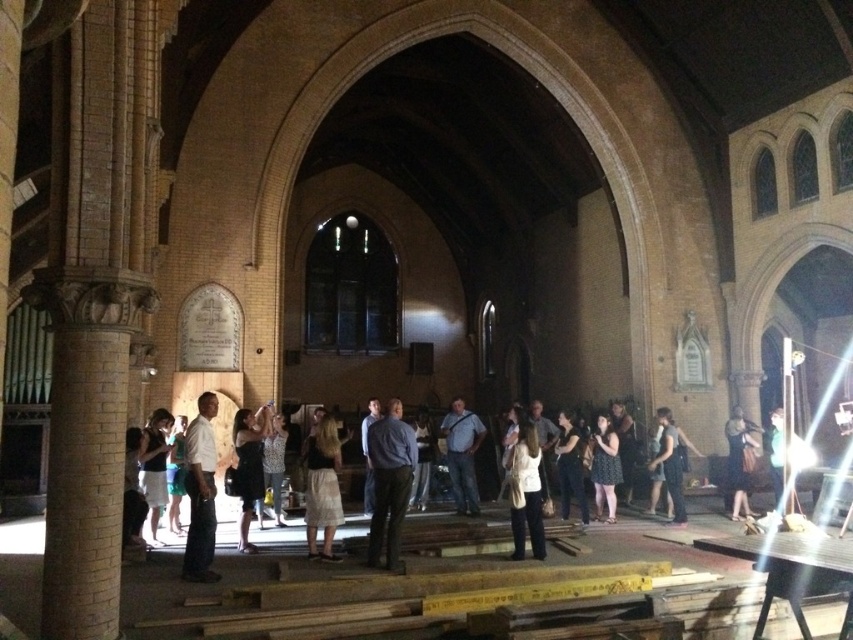
You are an event planner arranging seating for a small gathering in this historic building. You notice two attendees wearing a denim shirt at center and a dark blue dress at center. Since both are standing at the center, which one is closer to you?

The denim shirt at center is positioned over the dark blue dress at center, meaning it is closer to you.

You are organizing a charity event and need to seat guests in a row of chairs placed along the wall. The chairs are spaced exactly 1 meter apart. You have two dresses to consider for the event coordinator. The black dress at center and the white cotton dress at lower left. Which dress requires more space between the chairs to accommodate its width?

The black dress at center requires more space between the chairs because its width is larger than the white cotton dress at lower left.

You are standing in the historic building and notice two people in the foreground. One is wearing a dark gray dress at center and the other a blue shirt at center. From your perspective, which person is positioned to the right?

The dark gray dress at center is positioned to the right of the blue shirt at center.